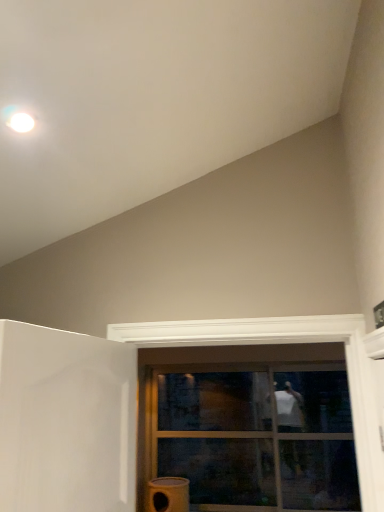
Question: Based on their sizes in the image, would you say transparent glass door at center is bigger or smaller than clear glass window at center?

Choices:
 (A) small
 (B) big

Answer: (A)

Question: Relative to clear glass window at center, is transparent glass door at center in front or behind?

Choices:
 (A) front
 (B) behind

Answer: (B)

Question: Which object is positioned closest to the clear glass window at center?

Choices:
 (A) transparent glass door at center
 (B) matte yellow water heater at lower center

Answer: (A)

Question: Which object is the closest to the transparent glass door at center?

Choices:
 (A) matte yellow water heater at lower center
 (B) clear glass window at center

Answer: (B)